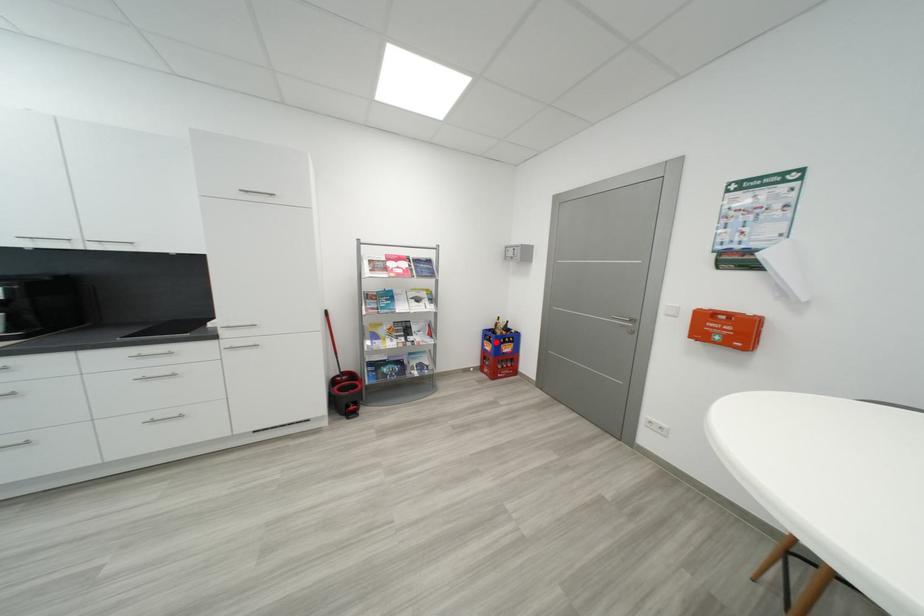
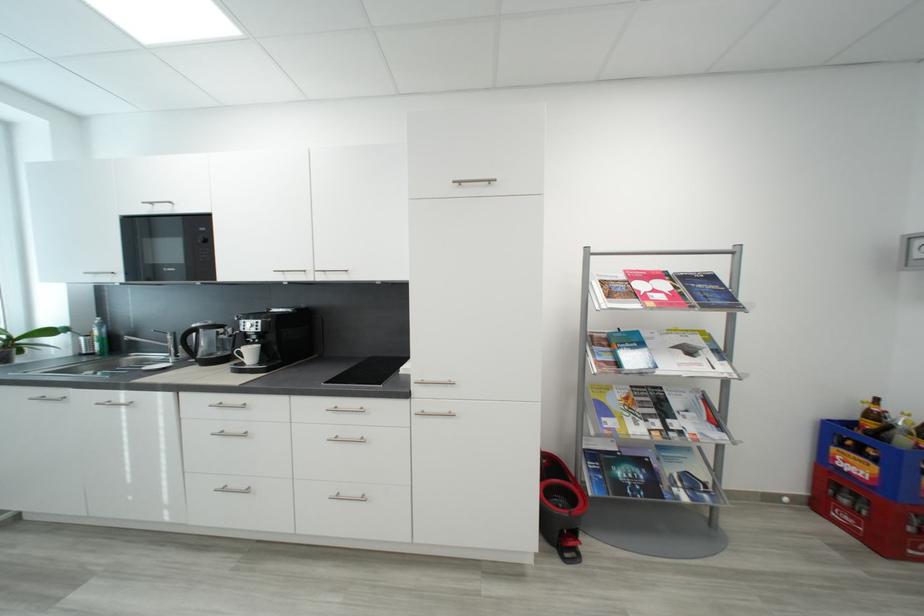
In the second image, find the point that corresponds to the highlighted location in the first image.

(867, 454)